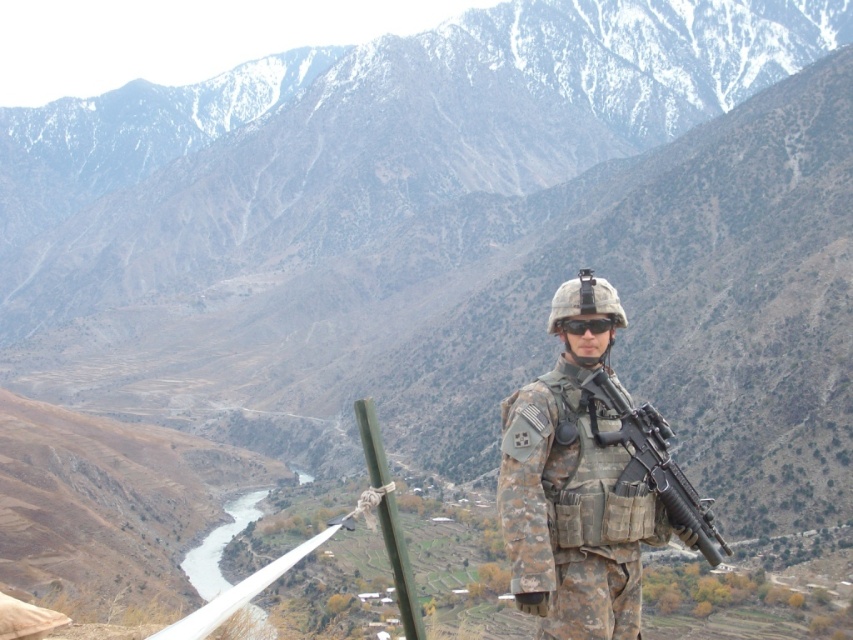
You are a photographer aiming to capture the soldier in the scene. You want to ensure that both the camouflage uniform at center and the black matte goggles at center are clearly visible in your photo. Which object should you focus on first to ensure both are in frame?

The camouflage uniform at center is to the right of black matte goggles at center. Since both objects are at the center, focusing on either one should keep both in frame. However, to ensure alignment, focus on the black matte goggles at center first as the camouflage uniform at center is positioned to its right, maintaining their spatial relationship.

You are a drone operator controlling a drone that can fly up to 150 feet. You need to fly the drone to the point at coordinates point (524, 545). Can your drone reach that point?

The point (524, 545) is 145.36 feet from camera, so yes, the drone can reach the point since it is within the drone maximum range of 150 feet.

The soldier is holding a matte black rifle at center and wearing black matte goggles at center. Which object is taller?

The matte black rifle at center is taller than the black matte goggles at center.